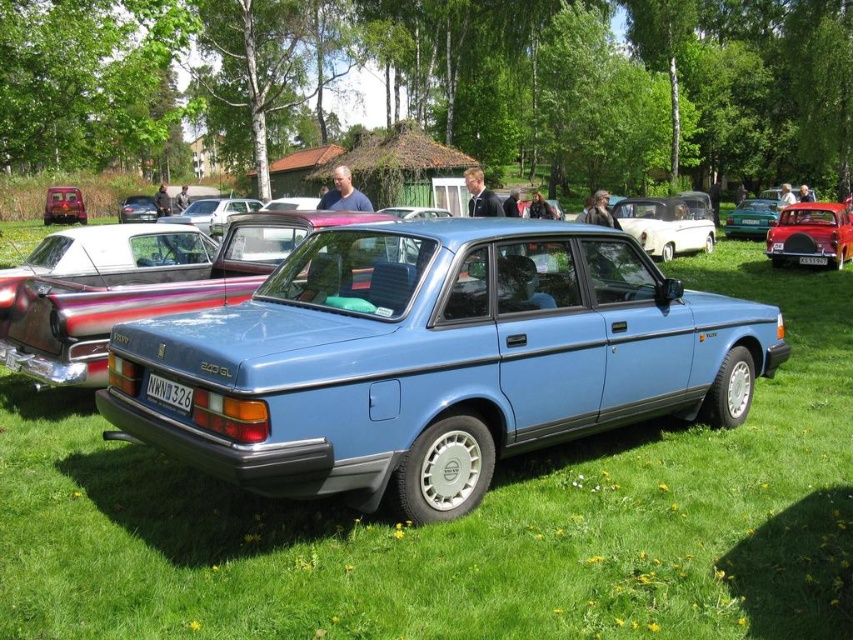
Is shiny red car at right to the left of black plastic license plate at center from the viewer's perspective?

In fact, shiny red car at right is to the right of black plastic license plate at center.

Is shiny red car at right bigger than black plastic license plate at center?

Correct, shiny red car at right is larger in size than black plastic license plate at center.

Is point (849, 221) closer to camera compared to point (805, 257)?

No.

Where is `shiny red car at right`? The width and height of the screenshot is (853, 640). shiny red car at right is located at coordinates (811, 236).

Does shiny red car at right appear over matte black car at center?

No.

Who is positioned more to the left, shiny red car at right or matte black car at center?

matte black car at center

Is point (824, 230) closer to camera compared to point (119, 218)?

Yes, it is in front of point (119, 218).

Find the location of a particular element. shiny red car at right is located at coordinates (811, 236).

Is point (131, 301) less distant than point (138, 216)?

That is True.

Which is in front, point (305, 228) or point (123, 208)?

Point (305, 228)

Locate an element on the screen. The image size is (853, 640). blue matte sedan at center is located at coordinates tap(144, 296).